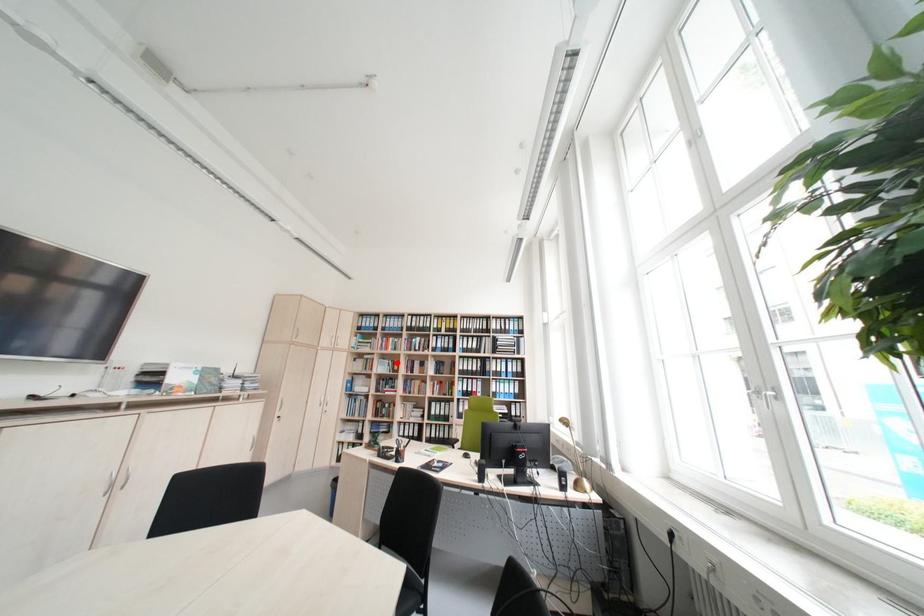
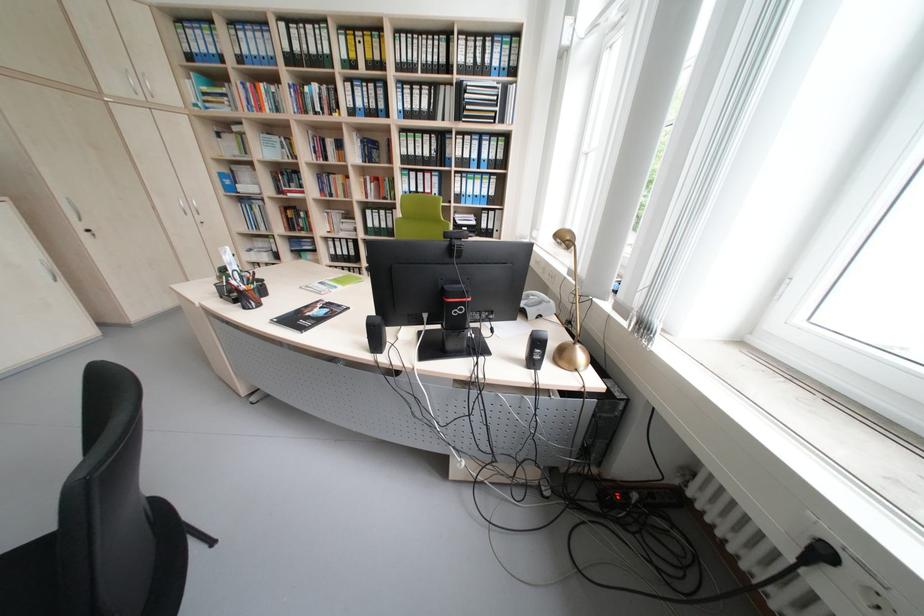
Locate, in the second image, the point that corresponds to the highlighted location in the first image.

(286, 140)